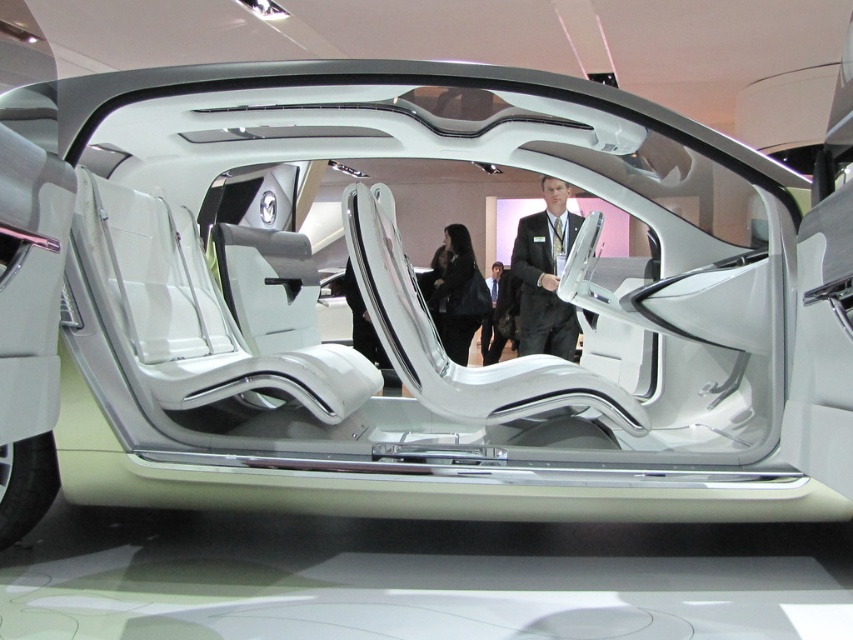
You are a photographer planning to take a closeup shot of the black suit at center and dark suit at center in the futuristic vehicle interior. Since you want to focus on both suits equally, which one should you zoom in on to ensure both are in frame?

You should zoom in on the dark suit at center because it is larger than the black suit at center, allowing both to be captured in the frame while maintaining focus on both.

You are a designer who wants to place a new seat in the futuristic vehicle. The seat must be placed exactly at the point where the black suit at center is currently located. What are the coordinates of that point?

The coordinates of the point where the black suit at center is located are 0.430 in the x direction and 0.640 in the y direction.